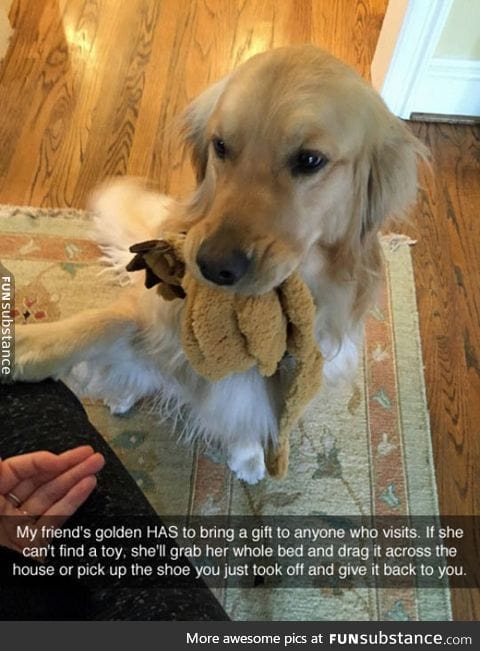
Find the location of a particular element. This screenshot has height=651, width=480. rug is located at coordinates (384, 394).